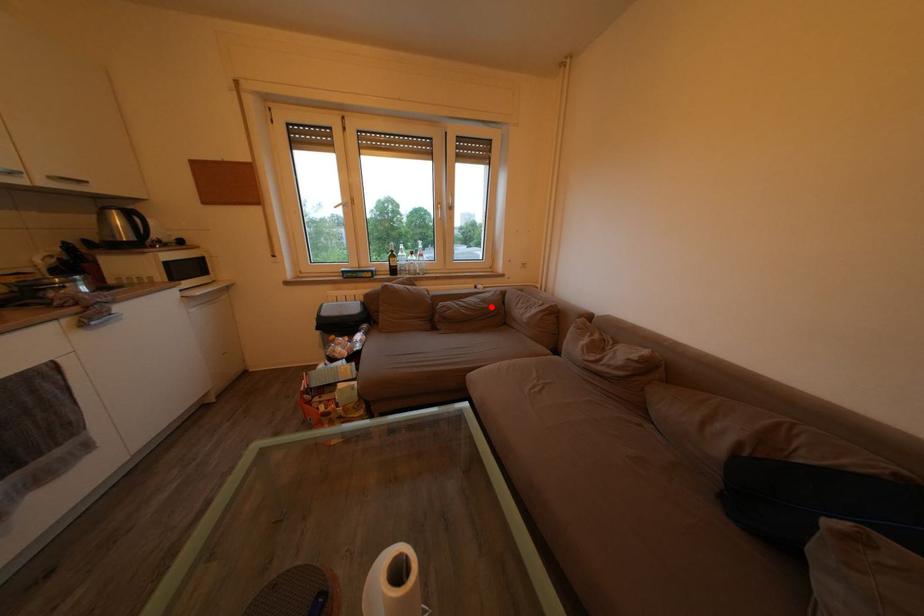
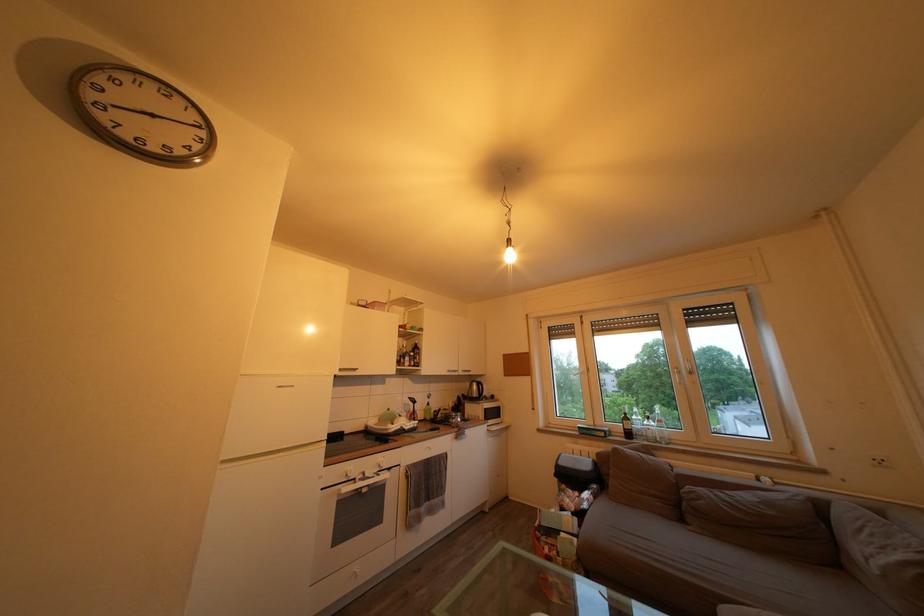
Question: I am providing you with two images of the same scene from different viewpoints. Image1 has a red point marked. In image2, the corresponding 3D location appears at what relative position? Reply with the corresponding letter.

Choices:
 (A) Closer
 (B) Farther

Answer: (A)